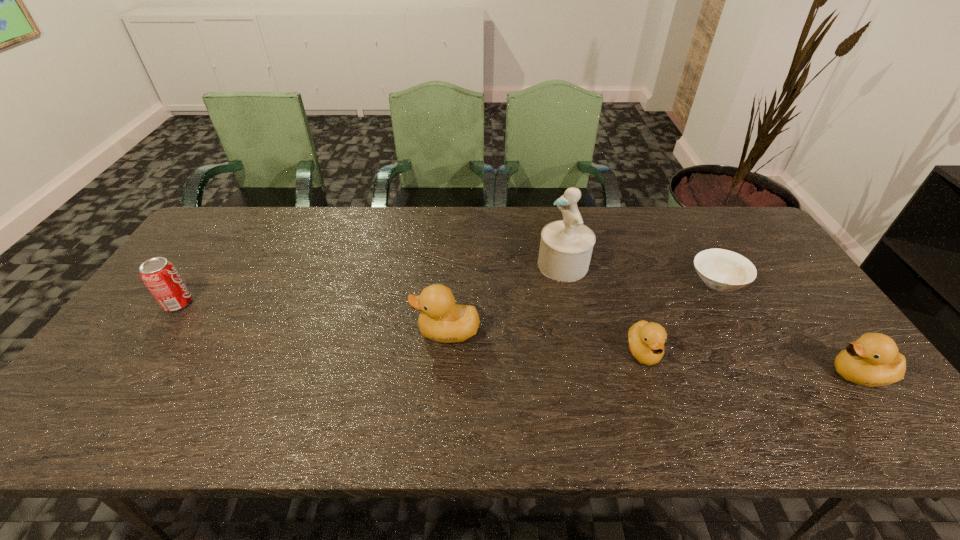
Image resolution: width=960 pixels, height=540 pixels. I want to click on unoccupied position between the rightmost duckling and the tallest object, so click(711, 320).

The image size is (960, 540). I want to click on free spot between the leftmost object and the leftmost duckling, so click(x=312, y=318).

Select which object appears as the fifth closest to the fifth tallest object. Please provide its 2D coordinates. Your answer should be formatted as a tuple, i.e. [(x, y)], where the tuple contains the x and y coordinates of a point satisfying the conditions above.

[(160, 276)]

You are a GUI agent. You are given a task and a screenshot of the screen. Output one action in this format:
    pyautogui.click(x=<x>, y=<y>)
    Task: Click on the object that is the second closest to the fifth object from right to left
    
    Given the screenshot: What is the action you would take?
    pyautogui.click(x=646, y=340)

Identify which duckling is the closest to the leftmost object. Please provide its 2D coordinates. Your answer should be formatted as a tuple, i.e. [(x, y)], where the tuple contains the x and y coordinates of a point satisfying the conditions above.

[(441, 320)]

Identify which duckling is the closest to the shortest duckling. Please provide its 2D coordinates. Your answer should be formatted as a tuple, i.e. [(x, y)], where the tuple contains the x and y coordinates of a point satisfying the conditions above.

[(441, 320)]

This screenshot has width=960, height=540. I want to click on free spot that satisfies the following two spatial constraints: 1. at the beak of the third object from left to right; 2. on the back side of the shortest object, so click(567, 282).